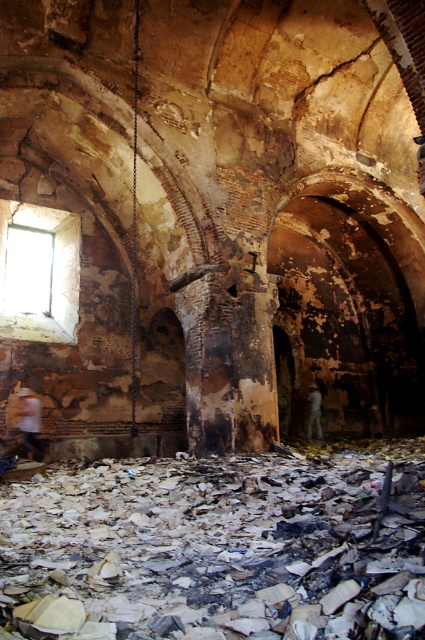
Question: Is white matte shirt at lower left thinner than denim jacket at lower right?

Choices:
 (A) yes
 (B) no

Answer: (A)

Question: Which point appears closest to the camera in this image?

Choices:
 (A) (297, 212)
 (B) (309, 403)
 (C) (30, 449)

Answer: (C)

Question: Which point is farther to the camera?

Choices:
 (A) transparent glass window at upper left
 (B) white matte shirt at lower left

Answer: (A)

Question: Can you confirm if burnt paper at center is positioned above denim jacket at lower right?

Choices:
 (A) yes
 (B) no

Answer: (A)

Question: Is transparent glass window at upper left wider than denim jacket at lower right?

Choices:
 (A) yes
 (B) no

Answer: (A)

Question: Which object appears farthest from the camera in this image?

Choices:
 (A) denim jacket at lower right
 (B) burnt paper at center
 (C) transparent glass window at upper left

Answer: (A)